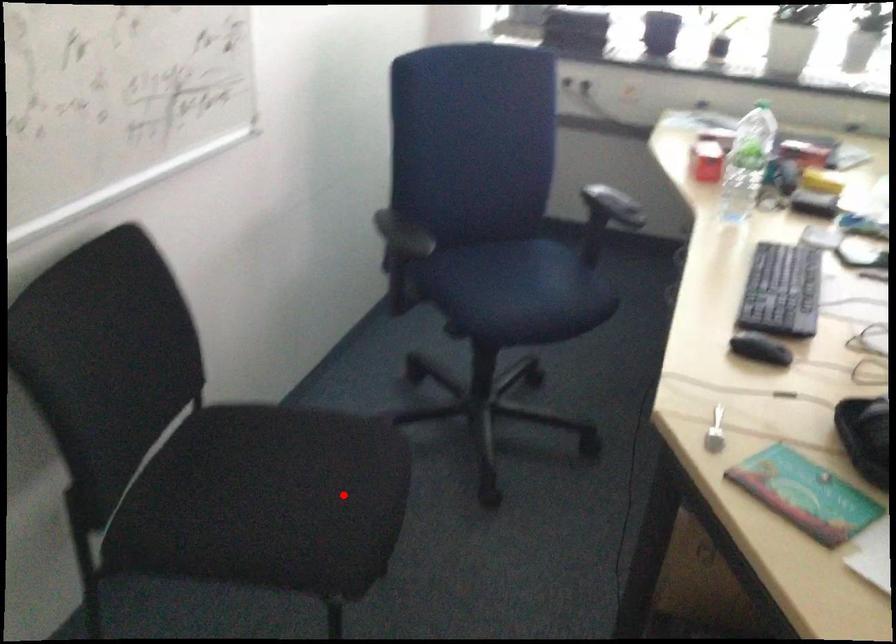
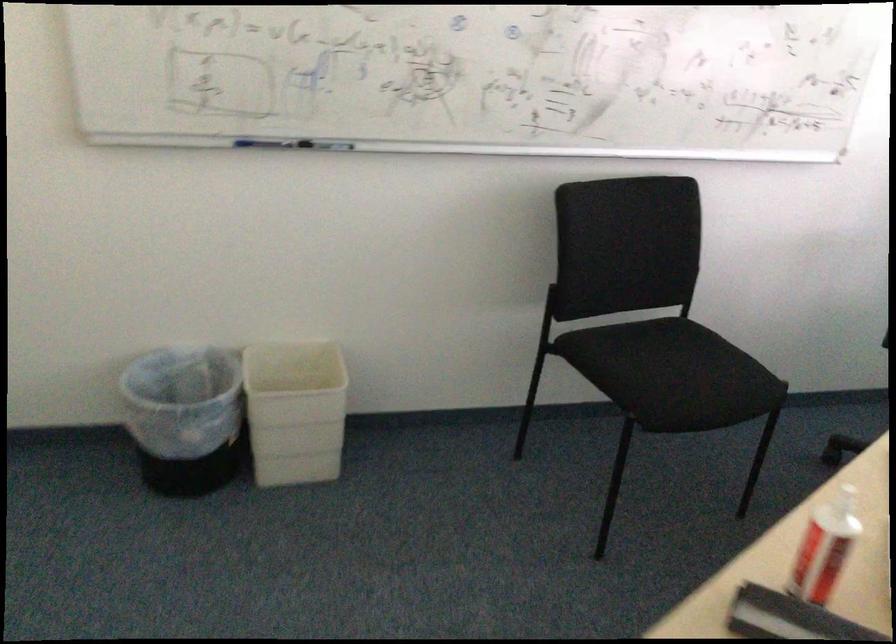
Question: I am providing you with two images of the same scene from different viewpoints. A red point is shown in image1. For the corresponding object point in image2, is it positioned nearer or farther from the camera?

Choices:
 (A) Nearer
 (B) Farther

Answer: (B)